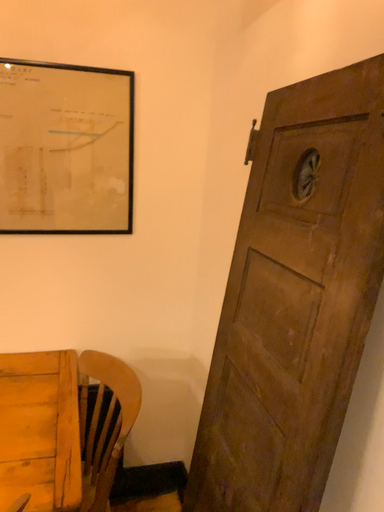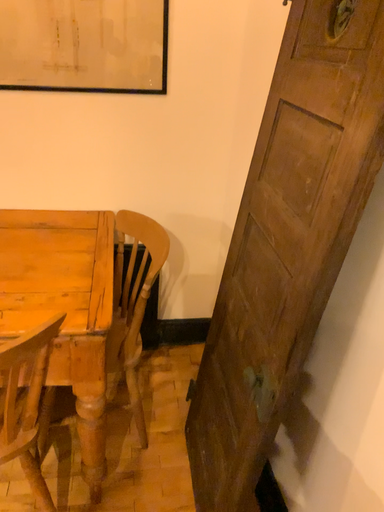
Question: How did the camera likely rotate when shooting the video?

Choices:
 (A) rotated upward
 (B) rotated downward

Answer: (B)